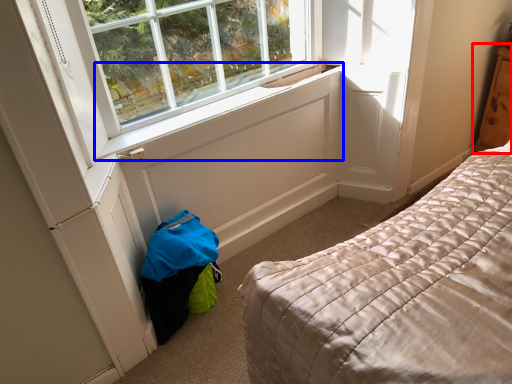
Question: Which point is closer to the camera, dresser (highlighted by a red box) or window sill (highlighted by a blue box)?

Choices:
 (A) dresser
 (B) window sill

Answer: (B)